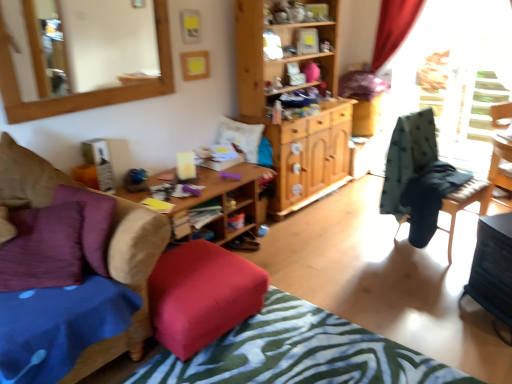
The height and width of the screenshot is (384, 512). Identify the location of unoccupied space behind textured green and white bedspread at lower center. (355, 269).